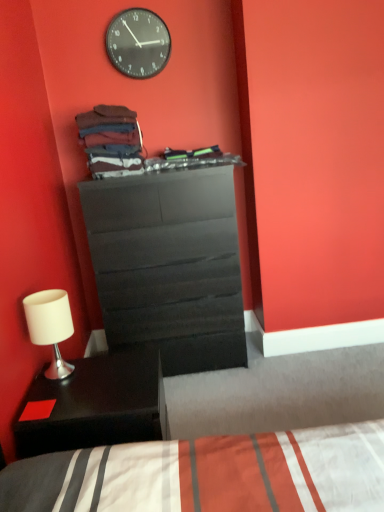
Question: From the image's perspective, relative to matte black dresser at center, is black matte nightstand at lower left above or below?

Choices:
 (A) below
 (B) above

Answer: (A)

Question: Considering the positions of black matte nightstand at lower left and matte black dresser at center in the image, is black matte nightstand at lower left bigger or smaller than matte black dresser at center?

Choices:
 (A) big
 (B) small

Answer: (B)

Question: Considering the real-world distances, which object is closest to the matte black dresser at center?

Choices:
 (A) black matte nightstand at lower left
 (B) white matte table lamp at lower left
 (C) black glass clock at upper center

Answer: (B)

Question: Which object is the closest to the matte black dresser at center?

Choices:
 (A) black glass clock at upper center
 (B) white matte table lamp at lower left
 (C) black matte nightstand at lower left

Answer: (B)